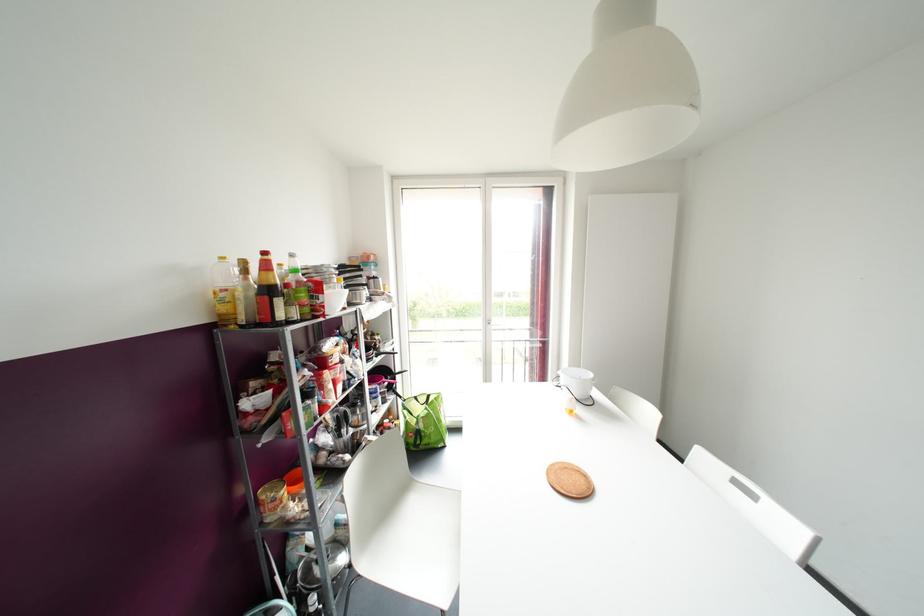
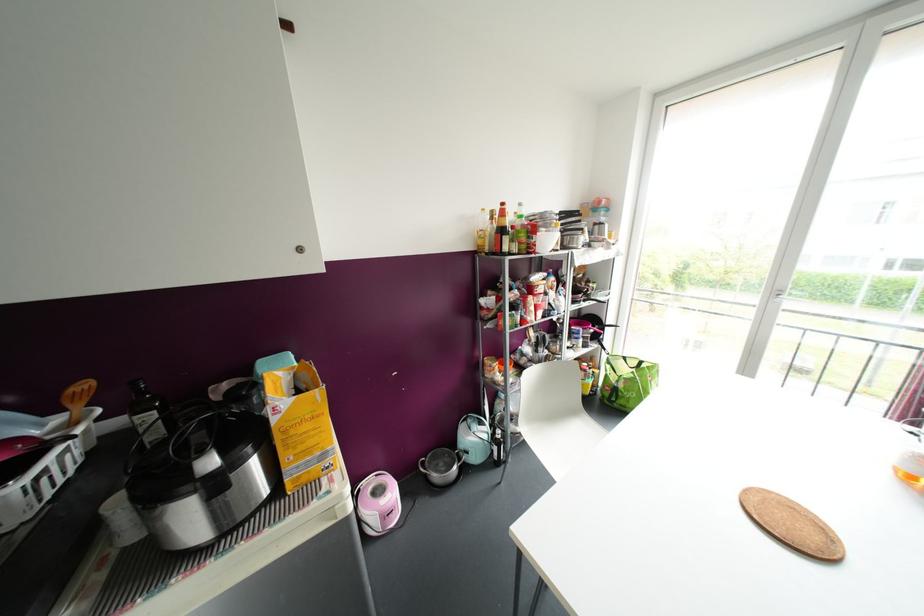
Find the pixel in the second image that matches [415,397] in the first image.

(624, 358)